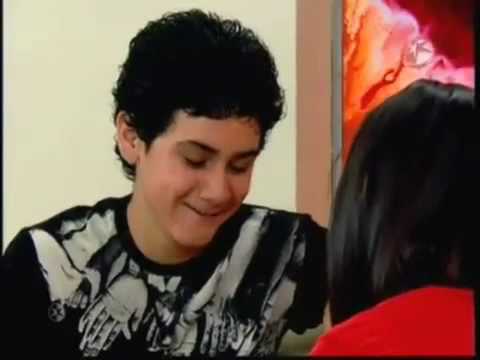
This screenshot has height=360, width=480. Find the location of `beige wall`. beige wall is located at coordinates (37, 125), (42, 40), (268, 10), (269, 176).